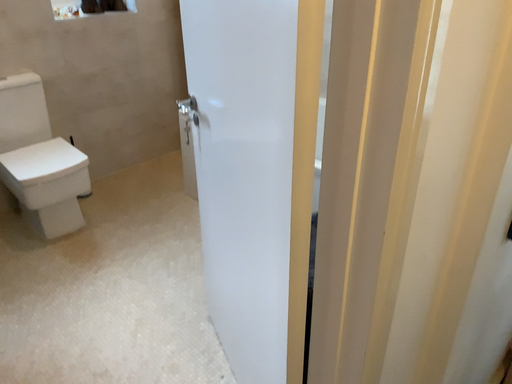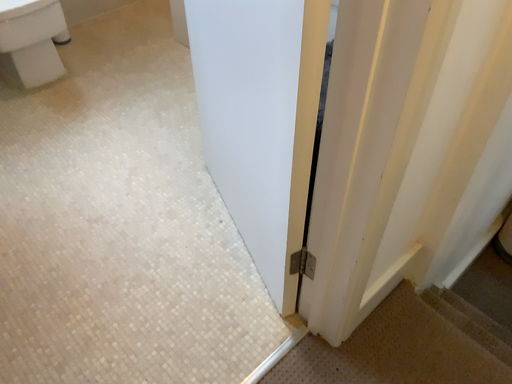
Question: Which way did the camera rotate in the video?

Choices:
 (A) rotated downward
 (B) rotated upward

Answer: (A)